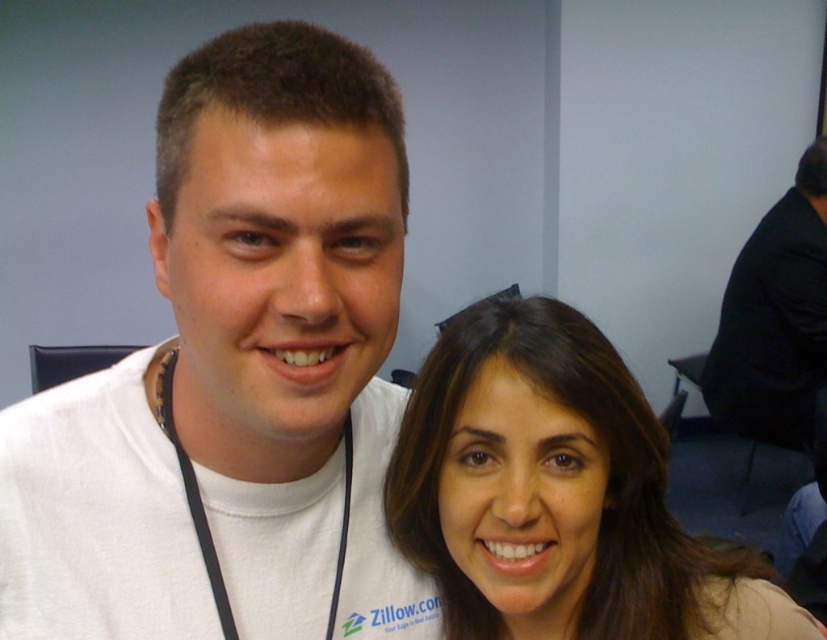
You are a photographer trying to frame a portrait of the two people in the image. You need to ensure that the brown hair at center and the black fabric shirt at right are both clearly visible. Which object should you adjust your focus on first to ensure proper exposure, considering their sizes?

The brown hair at center is shorter than the black fabric shirt at right, so you should focus on the black fabric shirt at right first because it is larger and might require more precise exposure adjustments.

You are taking a photo of the two people in the scene. The camera is positioned at a certain distance from the point marked at coordinates (447, 515). If you want to ensure that both individuals are in focus, what is the minimum distance the camera should be from the point to achieve this?

The camera is 23.34 inches away from the point marked at coordinates (447, 515). To ensure both individuals are in focus, the camera should be at least 23.34 inches away from the point.

You are a photographer setting up for a group photo. You notice two subjects in the scene. The first subject has brown hair at center, and the second is wearing a black fabric shirt at right. Based on their positions, which subject is closer to the left side of the frame?

The brown hair at center is to the left of the black fabric shirt at right, so the brown hair at center is closer to the left side of the frame.